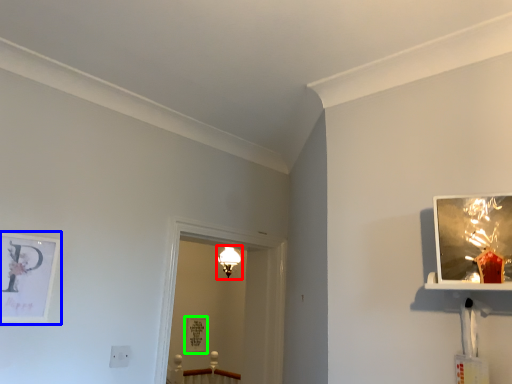
Question: Considering the real-world distances, which object is closest to light fixture (highlighted by a red box)? picture frame (highlighted by a blue box) or picture frame (highlighted by a green box).

Choices:
 (A) picture frame
 (B) picture frame

Answer: (A)